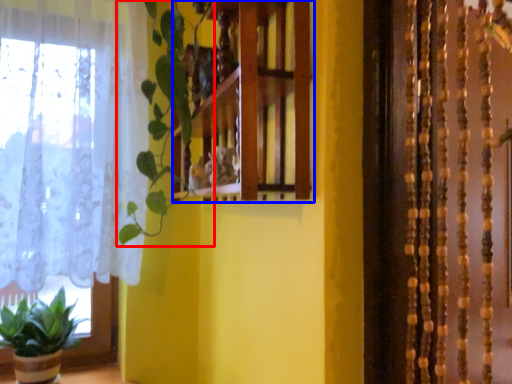
Question: Among these objects, which one is nearest to the camera, vegetation (highlighted by a red box) or shelf (highlighted by a blue box)?

Choices:
 (A) vegetation
 (B) shelf

Answer: (B)